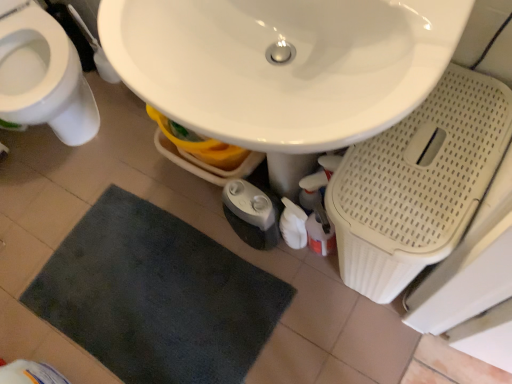
Based on the photo, what is the approximate width of dark gray plush bath mat at lower center?

It is 31.62 inches.

Measure the distance between dark gray plush bath mat at lower center and camera.

They are 1.27 meters apart.

Where is `white glossy toilet at left`? Image resolution: width=512 pixels, height=384 pixels. white glossy toilet at left is located at coordinates (42, 75).

You are a GUI agent. You are given a task and a screenshot of the screen. Output one action in this format:
    pyautogui.click(x=<x>, y=<y>)
    Task: Click on the white glossy sink at center
    This screenshot has width=512, height=384.
    Given the screenshot: What is the action you would take?
    pyautogui.click(x=283, y=65)

Locate an element on the screen. The width and height of the screenshot is (512, 384). dark gray plush bath mat at lower center is located at coordinates (157, 296).

Measure the distance between white glossy sink at center and white glossy toilet at left.

white glossy sink at center is 34.00 inches away from white glossy toilet at left.

Are white glossy sink at center and white glossy toilet at left making contact?

No, white glossy sink at center is not in contact with white glossy toilet at left.

Based on their sizes in the image, would you say white glossy sink at center is bigger or smaller than white glossy toilet at left?

In the image, white glossy sink at center appears to be smaller than white glossy toilet at left.

Considering the positions of point (356, 3) and point (45, 113), is point (356, 3) closer or farther from the camera than point (45, 113)?

Point (356, 3) appears to be closer to the viewer than point (45, 113).

Is point (175, 305) more distant than point (129, 21)?

That is True.

Considering the relative sizes of dark gray plush bath mat at lower center and white glossy sink at center in the image provided, is dark gray plush bath mat at lower center wider than white glossy sink at center?

Yes.

From the image's perspective, is dark gray plush bath mat at lower center on top of white glossy sink at center?

Actually, dark gray plush bath mat at lower center appears below white glossy sink at center in the image.

Considering the relative sizes of dark gray plush bath mat at lower center and white glossy sink at center in the image provided, is dark gray plush bath mat at lower center shorter than white glossy sink at center?

Correct, dark gray plush bath mat at lower center is not as tall as white glossy sink at center.

From a real-world perspective, is white glossy toilet at left located beneath dark gray plush bath mat at lower center?

Incorrect, from a real-world perspective, white glossy toilet at left is higher than dark gray plush bath mat at lower center.

Is white glossy toilet at left not inside dark gray plush bath mat at lower center?

white glossy toilet at left lies outside dark gray plush bath mat at lower center's area.

Image resolution: width=512 pixels, height=384 pixels. What are the coordinates of `toilet in front of the dark gray plush bath mat at lower center` in the screenshot? It's located at (42, 75).

Can you confirm if white glossy toilet at left is shorter than dark gray plush bath mat at lower center?

No.

Which object is positioned more to the left, dark gray plush bath mat at lower center or white glossy toilet at left?

white glossy toilet at left is more to the left.

Which is farther from the camera, (97, 249) or (5, 23)?

The point (97, 249) is behind.

At what (x,y) coordinates should I click in order to perform the action: click on toilet on the left of dark gray plush bath mat at lower center. Please return your answer as a coordinate pair (x, y). The height and width of the screenshot is (384, 512). Looking at the image, I should click on (42, 75).

In terms of size, does dark gray plush bath mat at lower center appear bigger or smaller than white glossy toilet at left?

Clearly, dark gray plush bath mat at lower center is smaller in size than white glossy toilet at left.

Between white glossy sink at center and dark gray plush bath mat at lower center, which one has larger size?

With larger size is white glossy sink at center.

Which of these two, white glossy sink at center or dark gray plush bath mat at lower center, stands taller?

white glossy sink at center is taller.

Is white glossy sink at center inside the boundaries of dark gray plush bath mat at lower center, or outside?

white glossy sink at center lies outside dark gray plush bath mat at lower center.

Does point (436, 39) appear closer or farther from the camera than point (125, 375)?

Point (436, 39) appears to be closer to the viewer than point (125, 375).

Is white glossy toilet at left spatially inside white glossy sink at center, or outside of it?

white glossy toilet at left cannot be found inside white glossy sink at center.

Considering the sizes of white glossy toilet at left and white glossy sink at center in the image, is white glossy toilet at left wider or thinner than white glossy sink at center?

Clearly, white glossy toilet at left has more width compared to white glossy sink at center.

Is point (45, 71) closer or farther from the camera than point (271, 110)?

Point (45, 71) is farther from the camera than point (271, 110).

From a real-world perspective, is white glossy toilet at left positioned over white glossy sink at center based on gravity?

No, from a real-world perspective, white glossy toilet at left is not over white glossy sink at center

In order to click on toilet on the left of white glossy sink at center in this screenshot , I will do `click(42, 75)`.

At what (x,y) coordinates should I click in order to perform the action: click on sink above the dark gray plush bath mat at lower center (from the image's perspective). Please return your answer as a coordinate pair (x, y). The height and width of the screenshot is (384, 512). Looking at the image, I should click on (283, 65).

From the image, which object appears to be farther from white glossy sink at center, dark gray plush bath mat at lower center or white glossy toilet at left?

Based on the image, white glossy toilet at left appears to be further to white glossy sink at center.

Estimate the real-world distances between objects in this image. Which object is further from white glossy toilet at left, dark gray plush bath mat at lower center or white glossy sink at center?

white glossy sink at center lies further to white glossy toilet at left than the other object.

Consider the image. From the image, which object appears to be farther from dark gray plush bath mat at lower center, white glossy sink at center or white glossy toilet at left?

white glossy sink at center is positioned further to the anchor dark gray plush bath mat at lower center.

Looking at the image, which one is located further to white glossy sink at center, white glossy toilet at left or dark gray plush bath mat at lower center?

Among the two, white glossy toilet at left is located further to white glossy sink at center.

Estimate the real-world distances between objects in this image. Which object is further from white glossy toilet at left, white glossy sink at center or dark gray plush bath mat at lower center?

Among the two, white glossy sink at center is located further to white glossy toilet at left.

Considering their positions, is white glossy toilet at left positioned further to dark gray plush bath mat at lower center than white glossy sink at center?

white glossy sink at center is further to dark gray plush bath mat at lower center.

This screenshot has height=384, width=512. Find the location of `sink that lies between white glossy toilet at left and dark gray plush bath mat at lower center from top to bottom`. sink that lies between white glossy toilet at left and dark gray plush bath mat at lower center from top to bottom is located at coordinates [x=283, y=65].